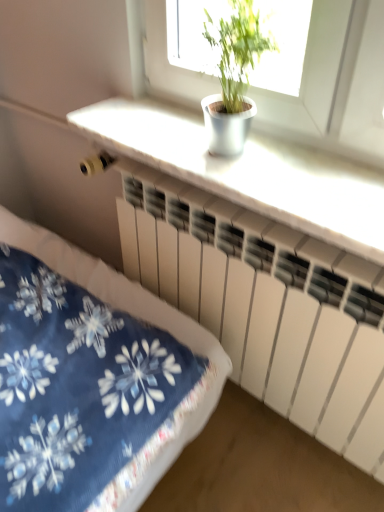
Identify the location of vacant space situated above white matte counter top at upper center (from a real-world perspective). The image size is (384, 512). (264, 159).